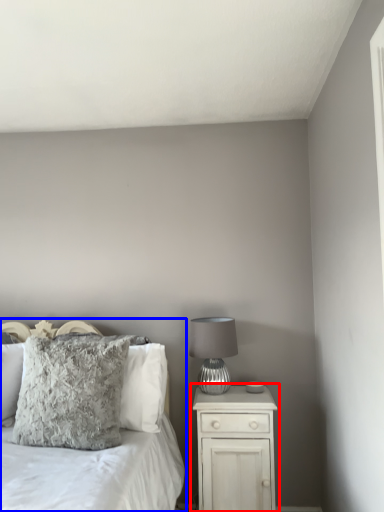
Question: Which object appears closest to the camera in this image, nightstand (highlighted by a red box) or bed (highlighted by a blue box)?

Choices:
 (A) nightstand
 (B) bed

Answer: (B)